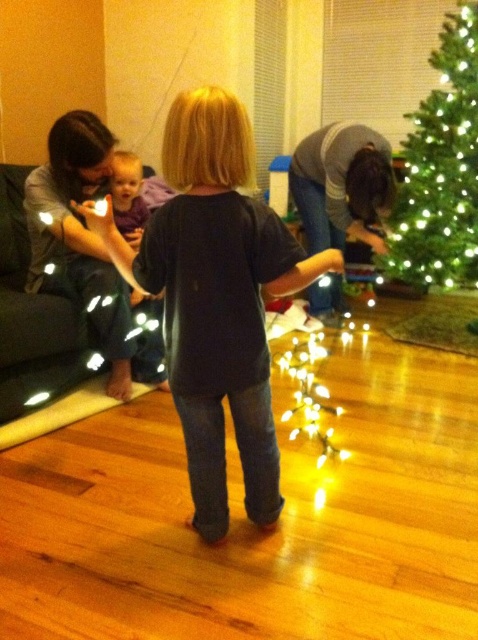
Does gray sweater at lower right come in front of matte purple shirt at upper left?

That is False.

Who is positioned more to the left, gray sweater at lower right or matte purple shirt at upper left?

Positioned to the left is matte purple shirt at upper left.

Find the location of a particular element. gray sweater at lower right is located at coordinates point(341,186).

Is green matte christmas tree at right taller than matte gray sweater at left?

Yes.

Is green matte christmas tree at right further to camera compared to matte gray sweater at left?

Yes, green matte christmas tree at right is behind matte gray sweater at left.

Locate an element on the screen. This screenshot has height=640, width=478. green matte christmas tree at right is located at coordinates (441, 168).

Is illuminated string lights at lower center wider than matte purple shirt at upper left?

Correct, the width of illuminated string lights at lower center exceeds that of matte purple shirt at upper left.

Is point (304, 348) positioned in front of point (129, 196)?

That is False.

At what (x,y) coordinates should I click in order to perform the action: click on illuminated string lights at lower center. Please return your answer as a coordinate pair (x, y). The image size is (478, 640). Looking at the image, I should click on [x=310, y=394].